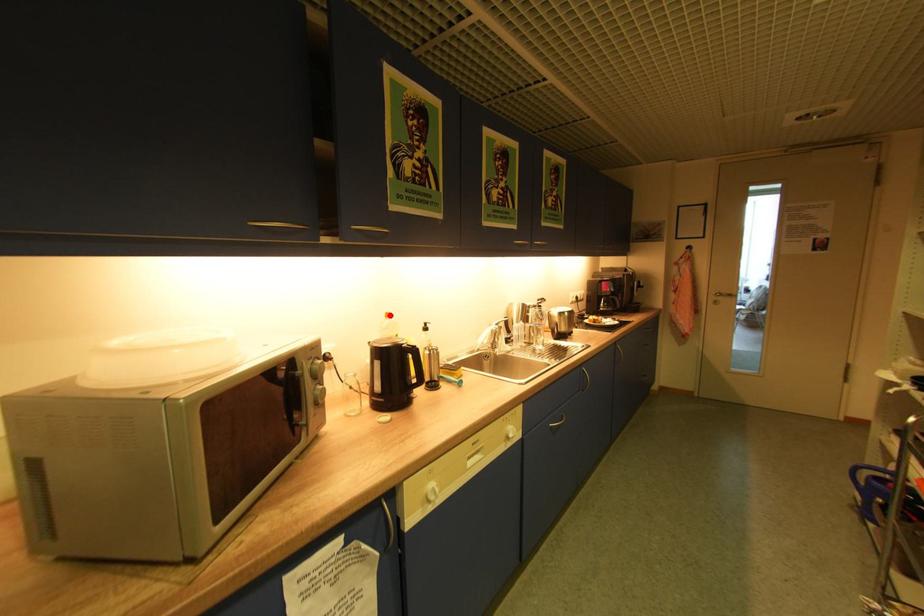
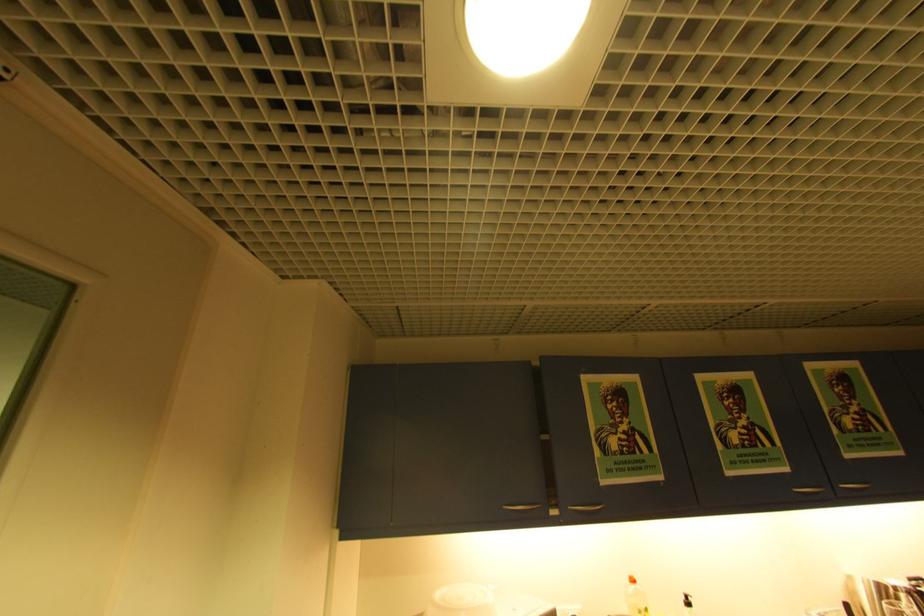
The point at the highlighted location is marked in the first image. Where is the corresponding point in the second image?

(634, 578)